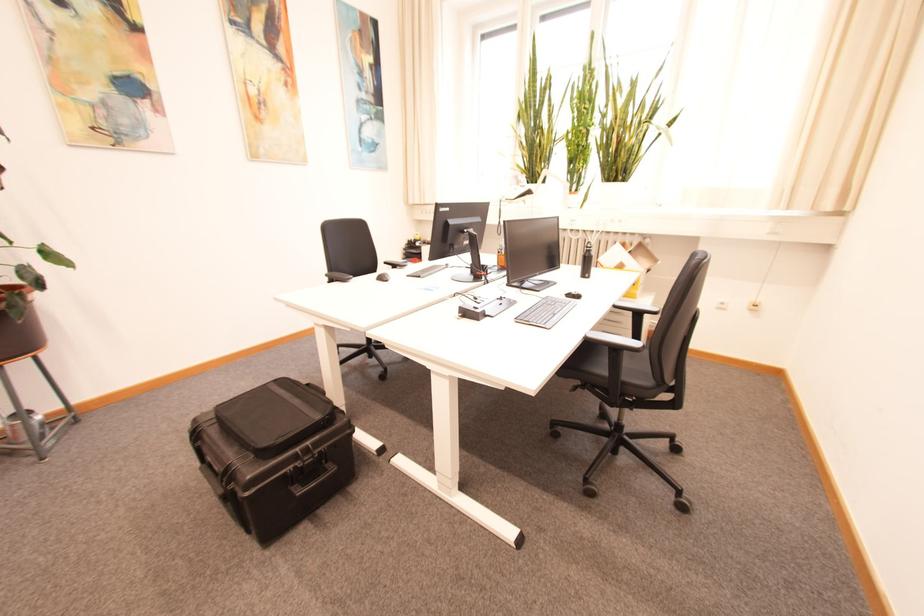
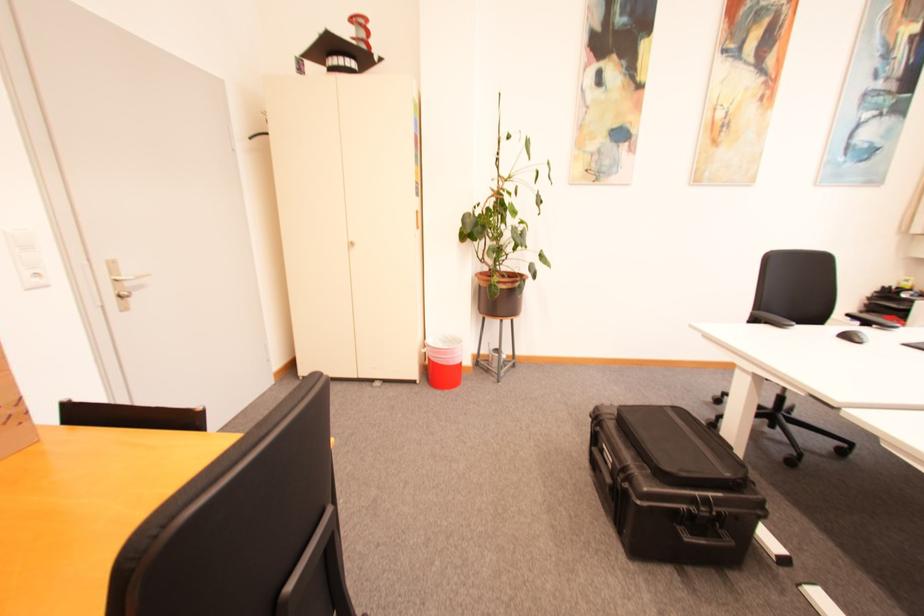
Locate, in the second image, the point that corresponds to (338,469) in the first image.

(736, 541)